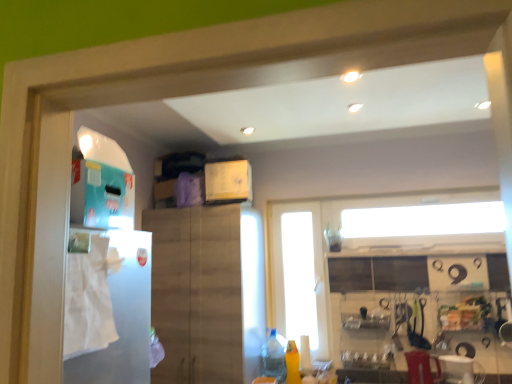
Question: In the image, is transparent glass door at center positioned in front of or behind clear plastic bottle at lower center, positioned as the 2th bottle in right-to-left order?

Choices:
 (A) front
 (B) behind

Answer: (B)

Question: Is transparent glass door at center bigger or smaller than clear plastic bottle at lower center, the first bottle viewed from the left?

Choices:
 (A) small
 (B) big

Answer: (B)

Question: Based on their relative distances, which object is nearer to the wooden cabinet at center?

Choices:
 (A) white plastic blender at lower right
 (B) white paper towel at left
 (C) yellow matte bottle at lower center, the 2th bottle positioned from the left
 (D) clear plastic bottle at lower center, positioned as the 2th bottle in right-to-left order
 (E) transparent glass door at center

Answer: (D)

Question: Considering the real-world distances, which object is farthest from the yellow matte bottle at lower center, the 2th bottle positioned from the left?

Choices:
 (A) white paper towel at left
 (B) white plastic blender at lower right
 (C) clear plastic bottle at lower center, the first bottle viewed from the left
 (D) wooden cabinet at center
 (E) transparent glass door at center

Answer: (A)